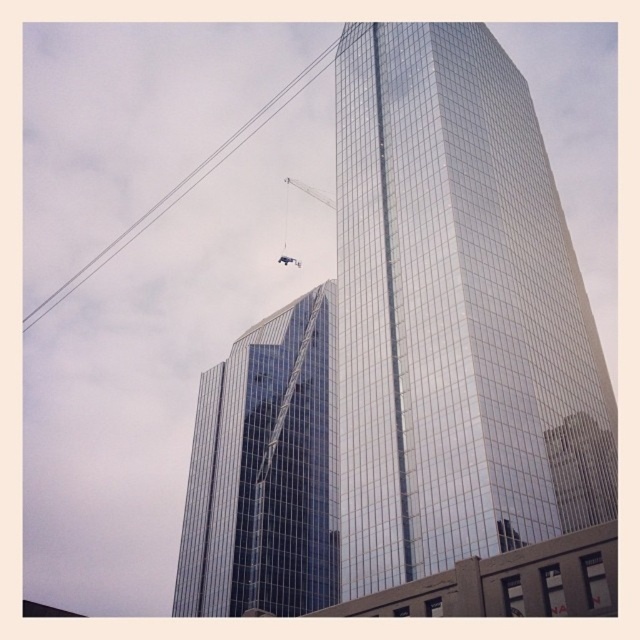
How far apart are glossy glass tower at center and shiny glass building at center?

glossy glass tower at center and shiny glass building at center are 34.85 meters apart from each other.

Can you confirm if glossy glass tower at center is shorter than shiny glass building at center?

Incorrect, glossy glass tower at center's height does not fall short of shiny glass building at center's.

This screenshot has height=640, width=640. Find the location of `glossy glass tower at center`. glossy glass tower at center is located at coordinates (456, 314).

Who is shorter, glossy glass tower at center or black wire at upper left?

Standing shorter between the two is glossy glass tower at center.

Is point (488, 74) in front of point (192, 177)?

Yes.

Is point (353, 134) less distant than point (330, 56)?

Yes.

Where is `glossy glass tower at center`? Image resolution: width=640 pixels, height=640 pixels. glossy glass tower at center is located at coordinates (456, 314).

Does shiny glass building at center have a greater height compared to black wire at upper left?

No.

Based on the photo, between shiny glass building at center and black wire at upper left, which one has more height?

black wire at upper left

What do you see at coordinates (262, 472) in the screenshot? I see `shiny glass building at center` at bounding box center [262, 472].

Locate an element on the screen. Image resolution: width=640 pixels, height=640 pixels. shiny glass building at center is located at coordinates (262, 472).